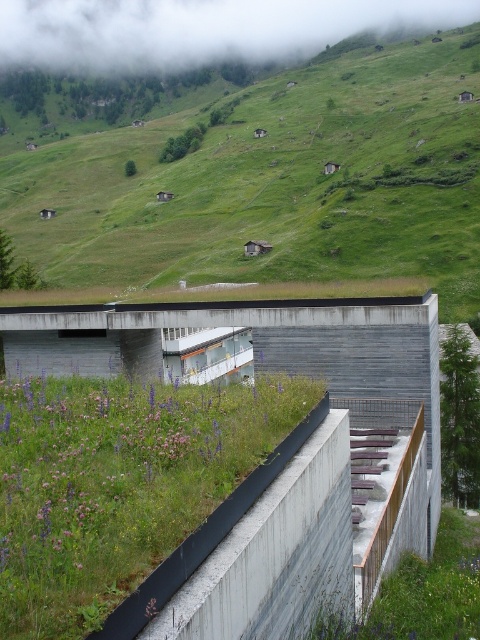
Question: Which of the following is the closest to the observer?

Choices:
 (A) (160, 436)
 (B) (217, 58)

Answer: (A)

Question: Is green grassy hillside at upper center thinner than white fluffy cloud at upper center?

Choices:
 (A) no
 (B) yes

Answer: (B)

Question: Which point is closer to the camera?

Choices:
 (A) (132, 586)
 (B) (400, 4)

Answer: (A)

Question: Observing the image, what is the correct spatial positioning of green grass at center in reference to white fluffy cloud at upper center?

Choices:
 (A) below
 (B) above

Answer: (A)

Question: Estimate the real-world distances between objects in this image. Which object is closer to the green grass at center?

Choices:
 (A) white fluffy cloud at upper center
 (B) green grassy hillside at upper center

Answer: (B)

Question: Does green grassy hillside at upper center appear over green grass at center?

Choices:
 (A) no
 (B) yes

Answer: (B)